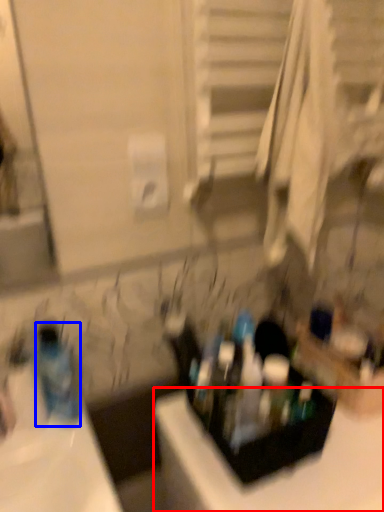
Question: Among these objects, which one is nearest to the camera, counter top (highlighted by a red box) or bottle (highlighted by a blue box)?

Choices:
 (A) counter top
 (B) bottle

Answer: (A)